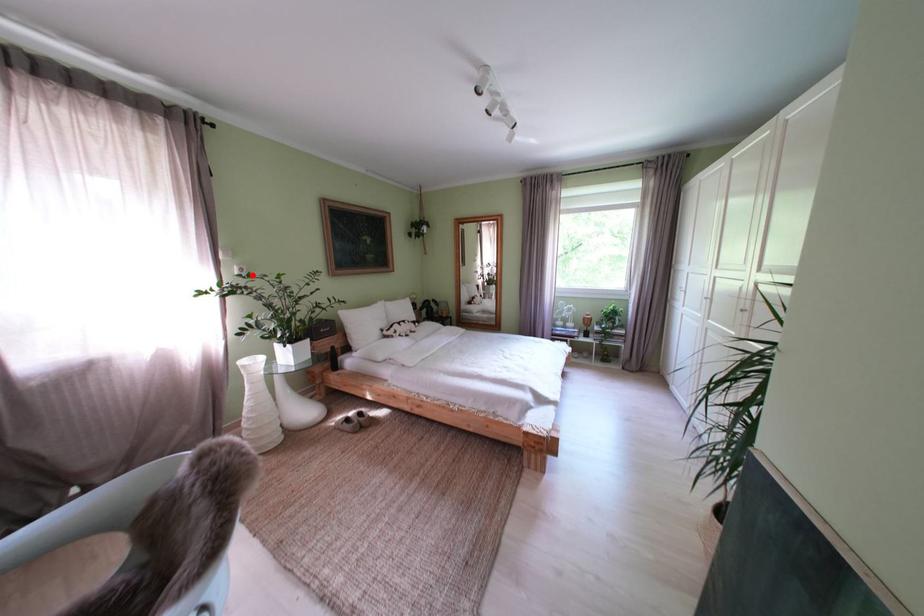
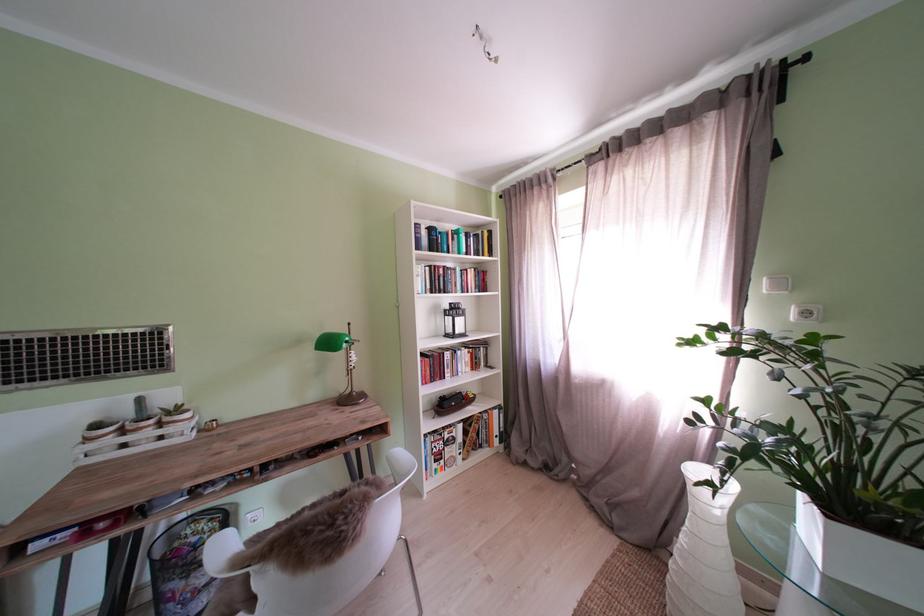
Locate, in the second image, the point that corresponds to the highlighted location in the first image.

(818, 318)